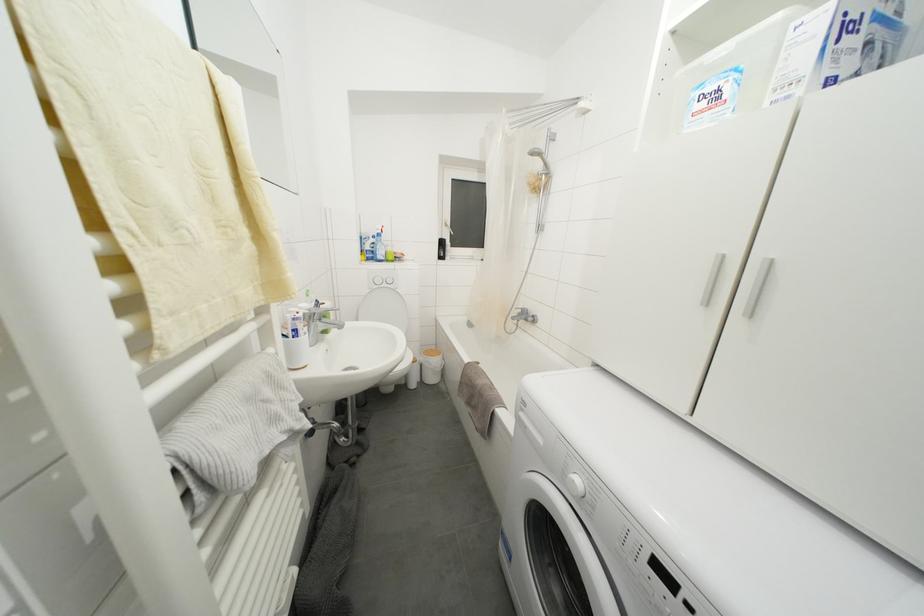
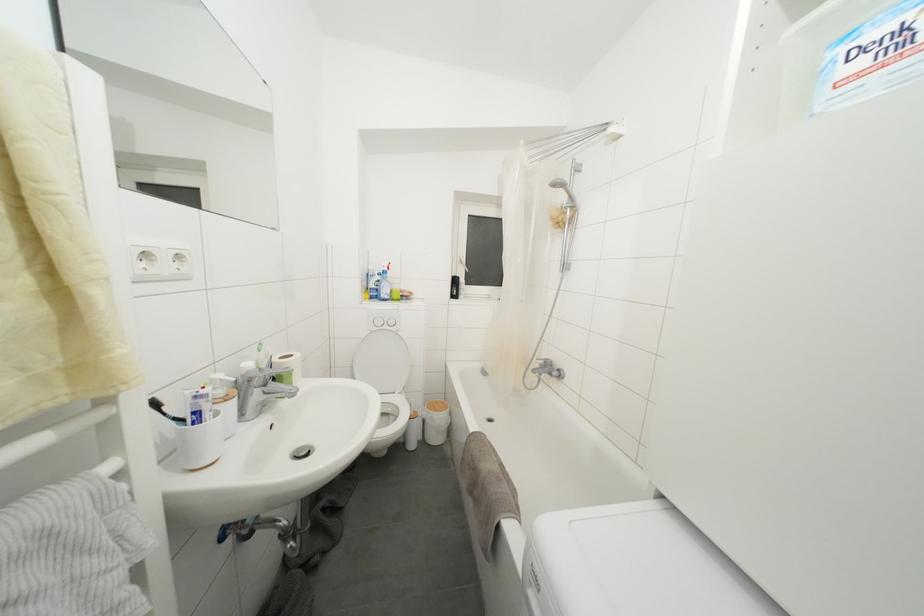
Where in the second image is the point corresponding to [374,261] from the first image?

(379, 300)